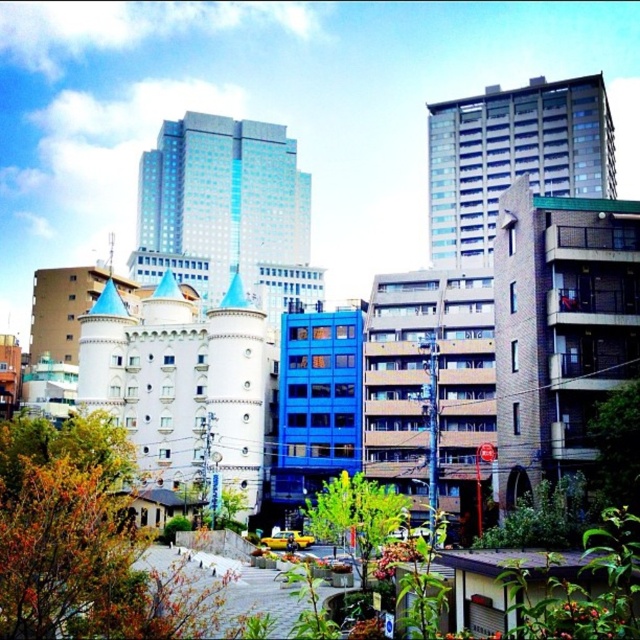
Is blue glass skyscraper at center to the right of gray concrete building at upper center from the viewer's perspective?

Incorrect, blue glass skyscraper at center is not on the right side of gray concrete building at upper center.

Does point (232, 125) come behind point (488, 129)?

Yes, it is.

Is point (141, 154) more distant than point (612, 157)?

Yes, it is behind point (612, 157).

Find the location of `blue glass skyscraper at center`. blue glass skyscraper at center is located at coordinates [x=225, y=211].

Does point (298, 292) lie in front of point (352, 477)?

No, it is behind (352, 477).

Who is more forward, [282,147] or [394,508]?

Positioned in front is point [394,508].

Where is `blue glass skyscraper at center`? The width and height of the screenshot is (640, 640). blue glass skyscraper at center is located at coordinates (225, 211).

Is green leafy tree at center thinner than green leafy tree at lower right?

In fact, green leafy tree at center might be wider than green leafy tree at lower right.

In the scene shown: Is green leafy tree at center above green leafy tree at lower right?

No, green leafy tree at center is not above green leafy tree at lower right.

Who is more distant from viewer, (376, 488) or (592, 468)?

Positioned behind is point (376, 488).

Image resolution: width=640 pixels, height=640 pixels. What are the coordinates of `green leafy tree at center` in the screenshot? It's located at (355, 515).